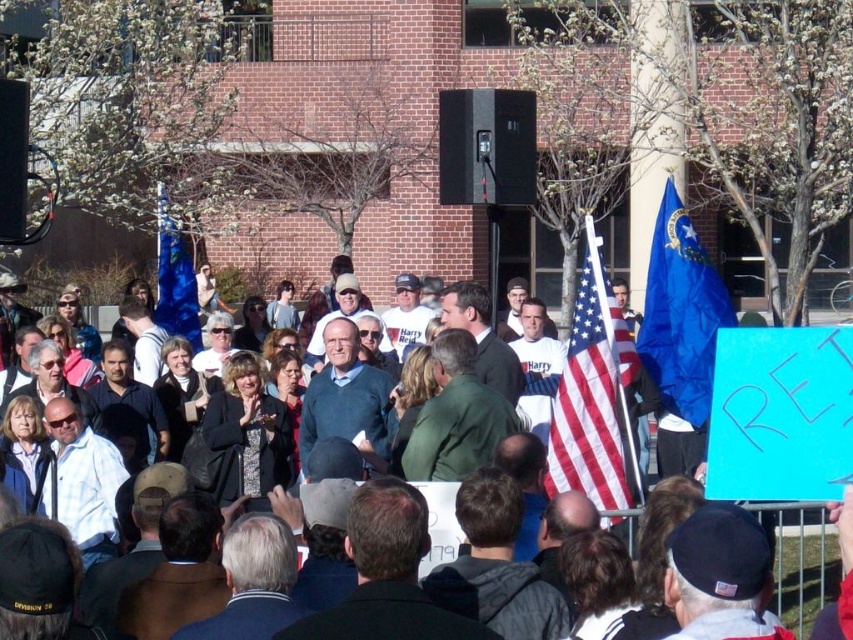
Which is below, american flag at center or white paper sign at center?

white paper sign at center is below.

Does point (589, 308) come farther from viewer compared to point (787, 566)?

No, it is not.

The height and width of the screenshot is (640, 853). I want to click on american flag at center, so click(x=595, y=396).

Is point (680, 291) positioned in front of point (189, 280)?

Yes, point (680, 291) is in front of point (189, 280).

This screenshot has height=640, width=853. I want to click on blue fabric flag at upper right, so click(x=682, y=316).

I want to click on blue fabric flag at upper right, so click(682, 316).

Does american flag at center have a smaller size compared to blue fabric flag at center?

Correct, american flag at center occupies less space than blue fabric flag at center.

Who is shorter, american flag at center or blue fabric flag at center?

Standing shorter between the two is blue fabric flag at center.

The height and width of the screenshot is (640, 853). I want to click on american flag at center, so click(595, 396).